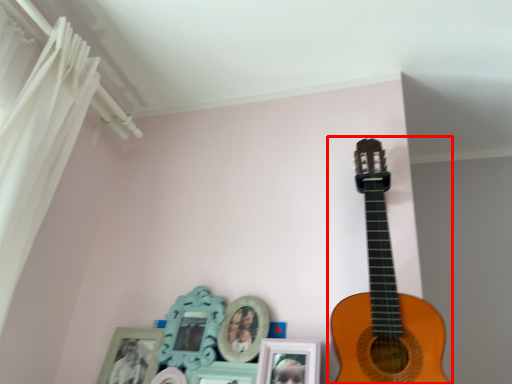
Question: From the image's perspective, what is the correct spatial positioning of guitar (annotated by the red box) in reference to curtain?

Choices:
 (A) above
 (B) below

Answer: (B)